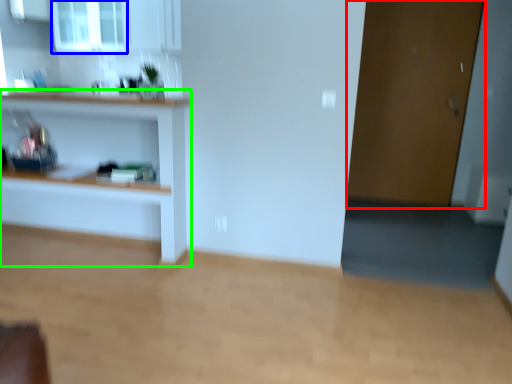
Question: Which object is positioned closest to door (highlighted by a red box)? Select from window (highlighted by a blue box) and shelf (highlighted by a green box).

Choices:
 (A) window
 (B) shelf

Answer: (B)